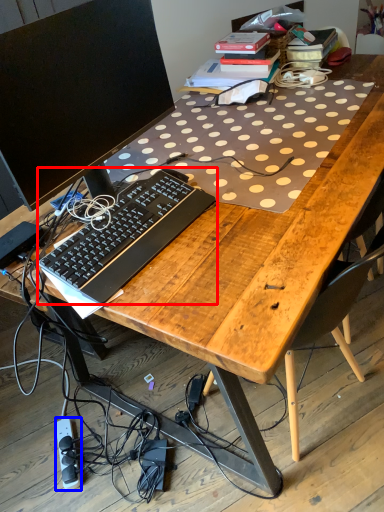
Question: Which point is further to the camera, computer keyboard (highlighted by a red box) or equipment (highlighted by a blue box)?

Choices:
 (A) computer keyboard
 (B) equipment

Answer: (B)